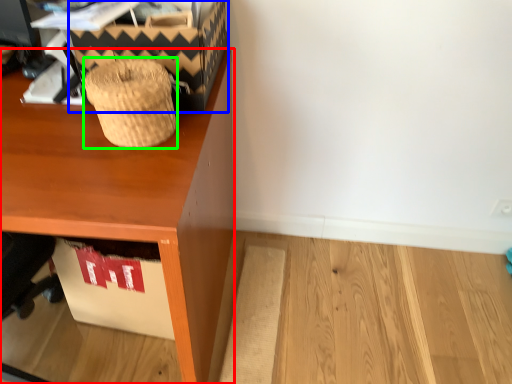
Question: Estimate the real-world distances between objects in this image. Which object is farther from desk (highlighted by a red box), shoe box (highlighted by a blue box) or basket (highlighted by a green box)?

Choices:
 (A) shoe box
 (B) basket

Answer: (A)